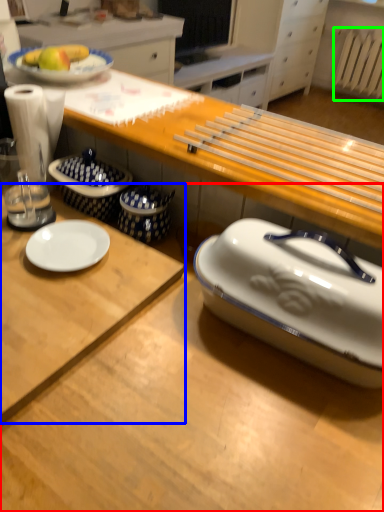
Question: Based on their relative distances, which object is farther from desk (highlighted by a red box)? Choose from desk (highlighted by a blue box) and radiator (highlighted by a green box).

Choices:
 (A) desk
 (B) radiator

Answer: (B)